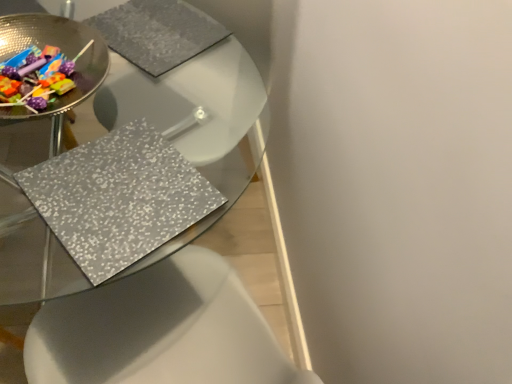
Question: Considering the relative sizes of shiny metallic bowl at upper left and metallic silver placemat at center in the image provided, is shiny metallic bowl at upper left taller than metallic silver placemat at center?

Choices:
 (A) yes
 (B) no

Answer: (B)

Question: Does shiny metallic bowl at upper left lie behind metallic silver placemat at center?

Choices:
 (A) yes
 (B) no

Answer: (A)

Question: Is shiny metallic bowl at upper left next to metallic silver placemat at center?

Choices:
 (A) no
 (B) yes

Answer: (A)

Question: Is metallic silver placemat at center surrounded by shiny metallic bowl at upper left?

Choices:
 (A) no
 (B) yes

Answer: (A)

Question: Considering the relative positions of shiny metallic bowl at upper left and metallic silver placemat at center in the image provided, is shiny metallic bowl at upper left in front of metallic silver placemat at center?

Choices:
 (A) no
 (B) yes

Answer: (A)

Question: Is shiny metallic bowl at upper left turned away from metallic silver placemat at center?

Choices:
 (A) no
 (B) yes

Answer: (A)

Question: Would you say shiny metallic bowl at upper left is part of metallic silver placemat at center's contents?

Choices:
 (A) no
 (B) yes

Answer: (A)

Question: Considering the relative sizes of metallic silver placemat at center and shiny metallic bowl at upper left in the image provided, is metallic silver placemat at center wider than shiny metallic bowl at upper left?

Choices:
 (A) no
 (B) yes

Answer: (B)

Question: Is metallic silver placemat at center not near shiny metallic bowl at upper left?

Choices:
 (A) no
 (B) yes

Answer: (A)

Question: Is metallic silver placemat at center shorter than shiny metallic bowl at upper left?

Choices:
 (A) yes
 (B) no

Answer: (B)

Question: Is metallic silver placemat at center positioned with its back to shiny metallic bowl at upper left?

Choices:
 (A) yes
 (B) no

Answer: (B)

Question: From a real-world perspective, is metallic silver placemat at center physically above shiny metallic bowl at upper left?

Choices:
 (A) yes
 (B) no

Answer: (B)

Question: From a real-world perspective, is shiny metallic bowl at upper left positioned above or below metallic silver placemat at center?

Choices:
 (A) below
 (B) above

Answer: (B)